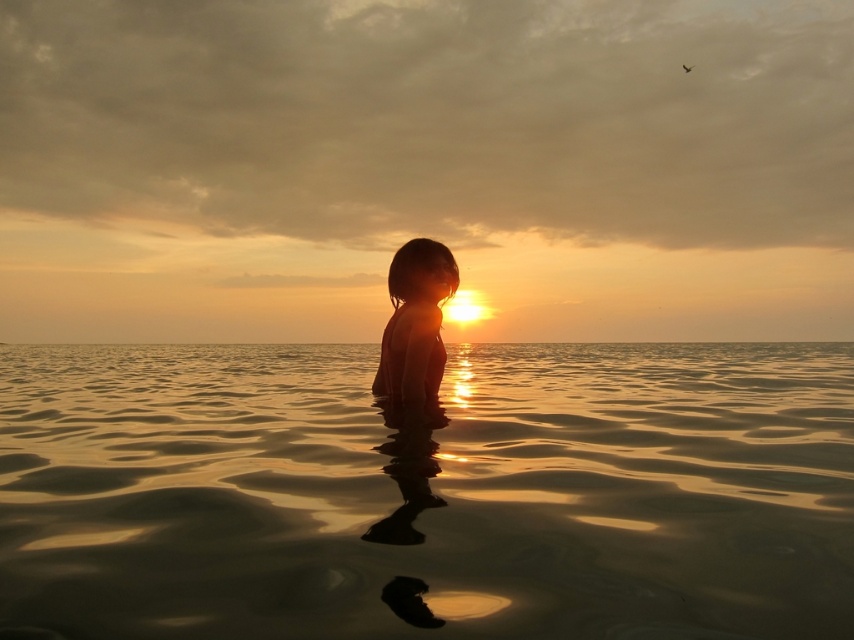
Does silhouette skin at center appear under golden water at center?

No.

Can you confirm if silhouette skin at center is thinner than golden water at center?

Yes.

At what (x,y) coordinates should I click in order to perform the action: click on silhouette skin at center. Please return your answer as a coordinate pair (x, y). The image size is (854, 640). Looking at the image, I should click on tap(414, 323).

Who is more forward, (x=788, y=605) or (x=151, y=342)?

Positioned in front is point (x=788, y=605).

Does glistening golden water at center have a lesser height compared to golden water at center?

No, glistening golden water at center is not shorter than golden water at center.

Image resolution: width=854 pixels, height=640 pixels. Describe the element at coordinates (428, 492) in the screenshot. I see `glistening golden water at center` at that location.

Locate an element on the screen. glistening golden water at center is located at coordinates (428, 492).

Between glistening golden water at center and silhouette skin at center, which one has less height?

silhouette skin at center is shorter.

Does point (214, 572) come behind point (398, 291)?

No, it is not.

Does point (676, 436) lie behind point (430, 387)?

Yes, point (676, 436) is behind point (430, 387).

Find the location of a particular element. This screenshot has width=854, height=640. glistening golden water at center is located at coordinates (428, 492).